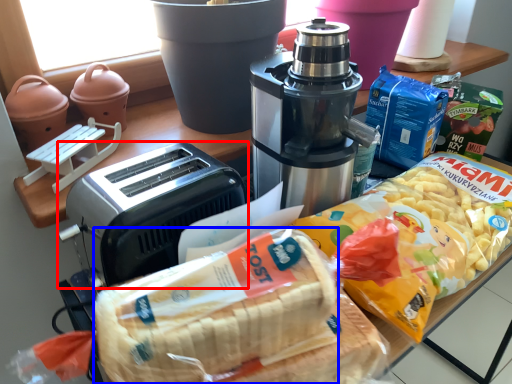
Question: Which of the following is the farthest to the observer, toaster (highlighted by a red box) or treat (highlighted by a blue box)?

Choices:
 (A) toaster
 (B) treat

Answer: (A)